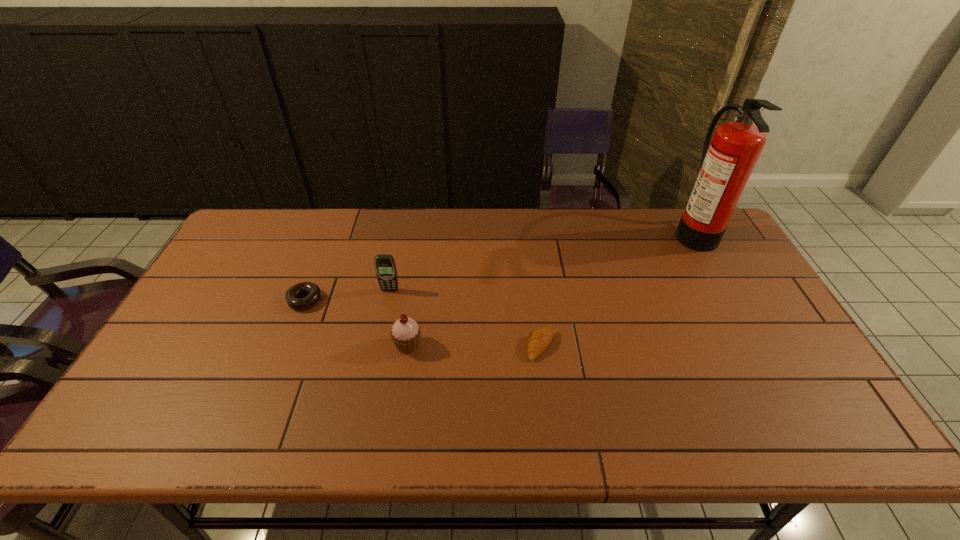
Where is `free space between the cellular telephone and the leftmost object`? This screenshot has width=960, height=540. free space between the cellular telephone and the leftmost object is located at coordinates (348, 295).

Choose which object is the third nearest neighbor to the leftmost object. Please provide its 2D coordinates. Your answer should be formatted as a tuple, i.e. [(x, y)], where the tuple contains the x and y coordinates of a point satisfying the conditions above.

[(540, 339)]

Locate an element on the screen. Image resolution: width=960 pixels, height=540 pixels. the second closest object to the third object from left to right is located at coordinates (313, 291).

Find the location of a particular element. This screenshot has height=540, width=960. vacant area in the image that satisfies the following two spatial constraints: 1. on the screen of the second object from left to right; 2. on the right side of the third tallest object is located at coordinates (378, 346).

Find the location of a particular element. This screenshot has width=960, height=540. free spot that satisfies the following two spatial constraints: 1. on the front-facing side of the tallest object; 2. on the front side of the third shortest object is located at coordinates (756, 346).